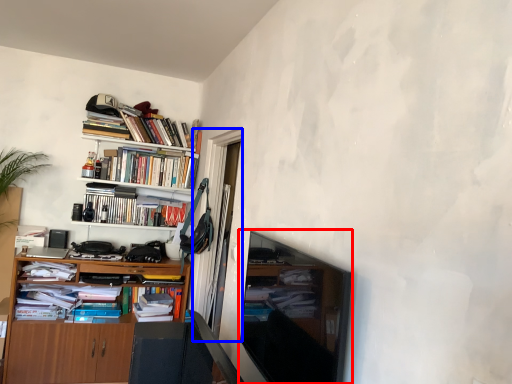
Question: Which object is further to the camera taking this photo, television (highlighted by a red box) or glass door (highlighted by a blue box)?

Choices:
 (A) television
 (B) glass door

Answer: (B)